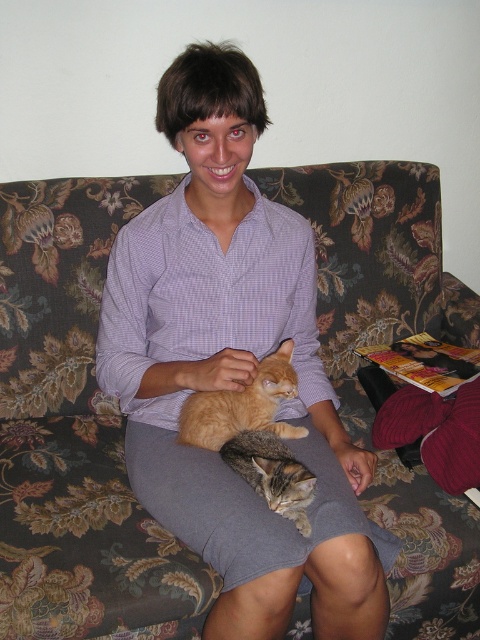
Is point (250, 420) farther from viewer compared to point (285, 497)?

Yes, it is behind point (285, 497).

In the scene shown: How distant is orange fur cat at center from tabby fur cat at center?

A distance of 3.31 inches exists between orange fur cat at center and tabby fur cat at center.

Does point (219, 442) come behind point (276, 465)?

Yes, point (219, 442) is farther from viewer.

Image resolution: width=480 pixels, height=640 pixels. Identify the location of orange fur cat at center. (242, 404).

Can you confirm if floral fabric couch at center is wider than tabby fur cat at center?

Indeed, floral fabric couch at center has a greater width compared to tabby fur cat at center.

From the picture: Does floral fabric couch at center come behind tabby fur cat at center?

Yes, floral fabric couch at center is further from the viewer.

Which is in front, point (92, 474) or point (241, 435)?

Point (241, 435)

Find the location of a particular element. The image size is (480, 640). floral fabric couch at center is located at coordinates (75, 433).

From the picture: Can you confirm if floral fabric couch at center is bigger than orange fur cat at center?

Correct, floral fabric couch at center is larger in size than orange fur cat at center.

Which is above, floral fabric couch at center or orange fur cat at center?

floral fabric couch at center

Is point (84, 312) more distant than point (226, 410)?

Yes, it is.

This screenshot has width=480, height=640. Find the location of `floral fabric couch at center`. floral fabric couch at center is located at coordinates (75, 433).